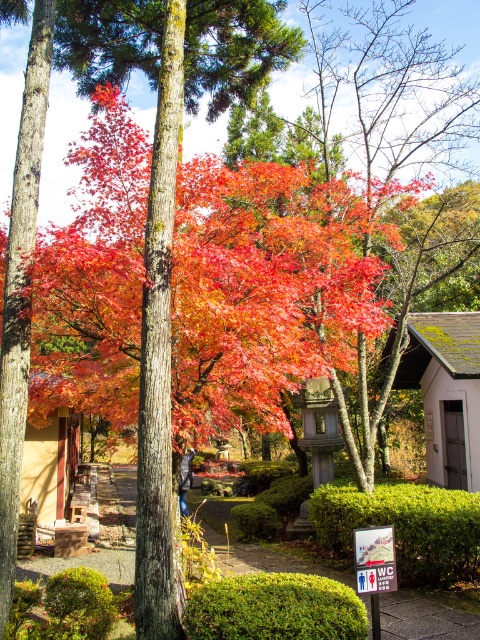
Question: Which of the following is the farthest from the observer?

Choices:
 (A) green leafy bush at lower center
 (B) green leafy hedge at lower left
 (C) green leafy hedge at lower center
 (D) beige wooden hut at lower left

Answer: (D)

Question: Which point appears farthest from the camera in this image?

Choices:
 (A) (13, 593)
 (B) (195, 600)

Answer: (A)

Question: Is green mossy wood hut at right positioned at the back of green leafy hedge at lower left?

Choices:
 (A) no
 (B) yes

Answer: (B)

Question: Which of the following is the closest to the observer?

Choices:
 (A) green leafy bush at lower center
 (B) green leafy hedge at lower center
 (C) green mossy wood hut at right

Answer: (A)

Question: Does green mossy wood hut at right come behind green leafy bush at lower center?

Choices:
 (A) no
 (B) yes

Answer: (B)

Question: Can you confirm if green leafy hedge at lower center is positioned above beige wooden hut at lower left?

Choices:
 (A) no
 (B) yes

Answer: (B)